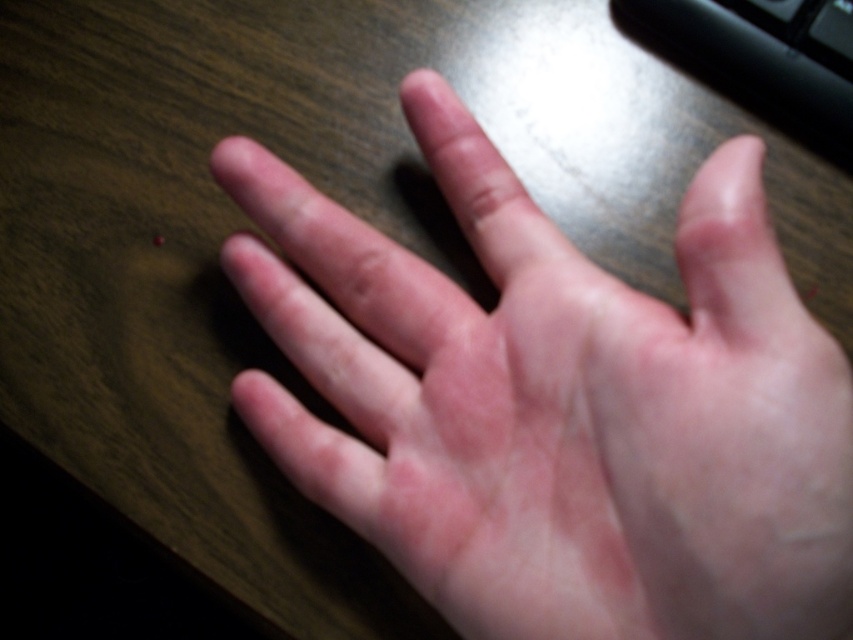
Question: Is pale skin hand at center above black plastic keyboard at upper right?

Choices:
 (A) yes
 (B) no

Answer: (B)

Question: Among these objects, which one is nearest to the camera?

Choices:
 (A) pale skin hand at center
 (B) black plastic keyboard at upper right

Answer: (A)

Question: Where is pale skin hand at center located in relation to black plastic keyboard at upper right in the image?

Choices:
 (A) left
 (B) right

Answer: (A)

Question: Does pale skin hand at center have a smaller size compared to black plastic keyboard at upper right?

Choices:
 (A) yes
 (B) no

Answer: (B)

Question: Which of the following is the farthest from the observer?

Choices:
 (A) (596, 310)
 (B) (840, 132)

Answer: (B)

Question: Which object is closer to the camera taking this photo?

Choices:
 (A) pale skin hand at center
 (B) black plastic keyboard at upper right

Answer: (A)